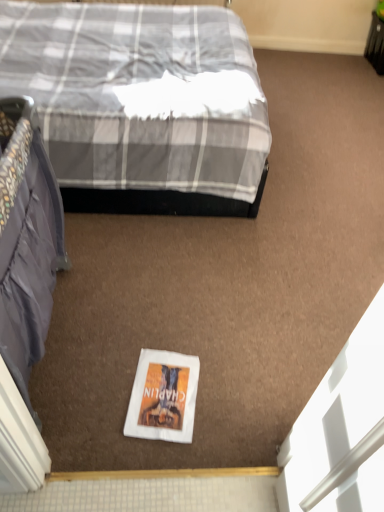
This screenshot has height=512, width=384. What do you see at coordinates (163, 397) in the screenshot? I see `white paper at center` at bounding box center [163, 397].

This screenshot has width=384, height=512. Identify the location of white paper at center. (163, 397).

This screenshot has width=384, height=512. Identify the location of white paper at center. (163, 397).